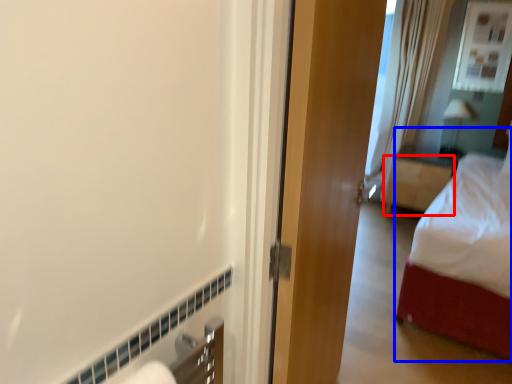
Question: Which of the following is the closest to the observer, furniture (highlighted by a red box) or bed (highlighted by a blue box)?

Choices:
 (A) furniture
 (B) bed

Answer: (B)